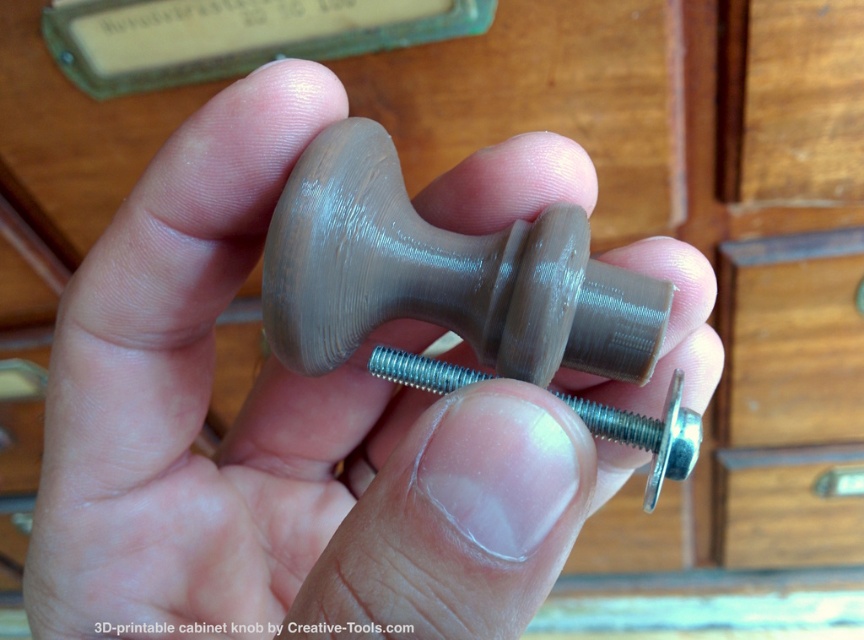
Who is positioned more to the right, matte brown knob at center or satin silver metallic bolt at center?

From the viewer's perspective, satin silver metallic bolt at center appears more on the right side.

Does matte brown knob at center have a lesser height compared to satin silver metallic bolt at center?

Incorrect, matte brown knob at center's height does not fall short of satin silver metallic bolt at center's.

Who is more distant from viewer, (471, 490) or (683, 458)?

Point (683, 458)

I want to click on matte brown knob at center, so click(x=277, y=435).